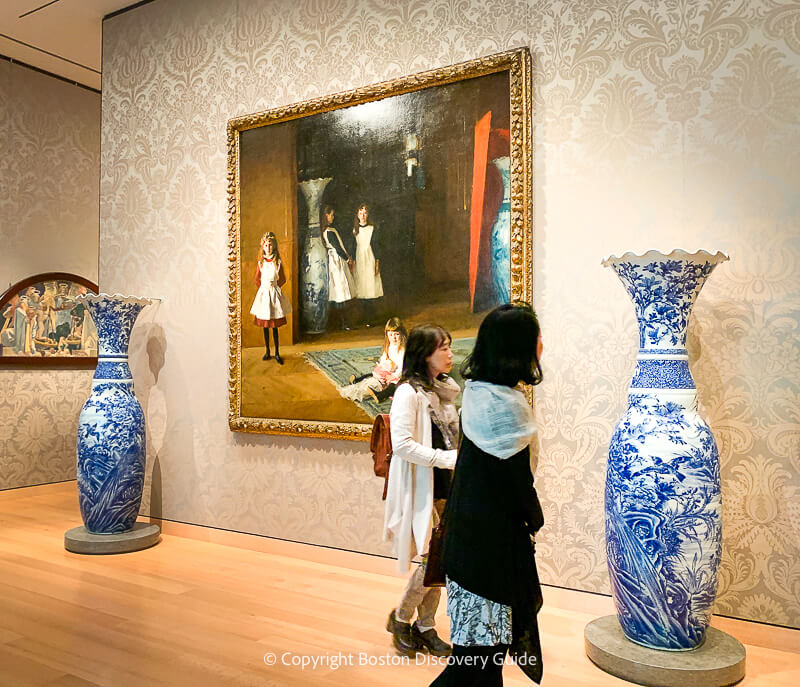
I want to click on paintigs, so click(420, 254), click(58, 322).